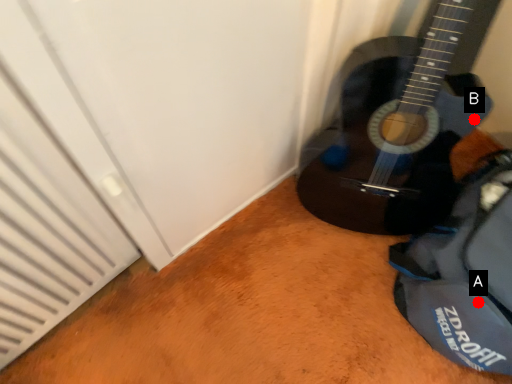
Question: Two points are circled on the image, labeled by A and B beside each circle. Which point is farther to the camera?

Choices:
 (A) A is further
 (B) B is further

Answer: (B)